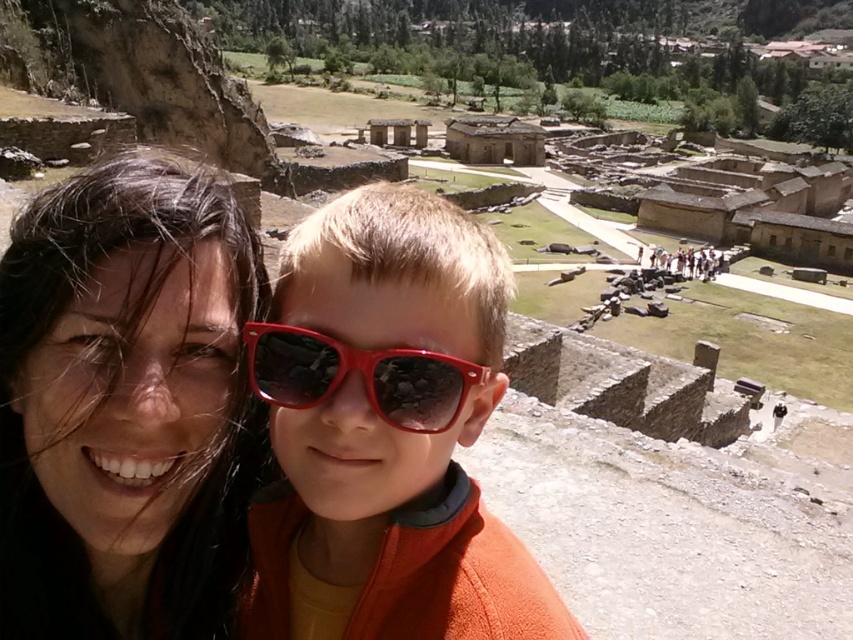
Question: Is matte black hair at upper left positioned behind shiny plastic goggles at center?

Choices:
 (A) yes
 (B) no

Answer: (B)

Question: Which object is the closest to the shiny plastic goggles at center?

Choices:
 (A) matte black hair at upper left
 (B) matte plastic sunglasses at center

Answer: (B)

Question: Is matte black hair at upper left smaller than matte plastic sunglasses at center?

Choices:
 (A) yes
 (B) no

Answer: (B)

Question: Observing the image, what is the correct spatial positioning of matte plastic sunglasses at center in reference to shiny plastic goggles at center?

Choices:
 (A) right
 (B) left

Answer: (A)

Question: Estimate the real-world distances between objects in this image. Which object is farther from the matte plastic sunglasses at center?

Choices:
 (A) shiny plastic goggles at center
 (B) matte black hair at upper left

Answer: (B)

Question: Which point is closer to the camera?

Choices:
 (A) (274, 346)
 (B) (457, 284)
 (C) (222, 563)

Answer: (C)